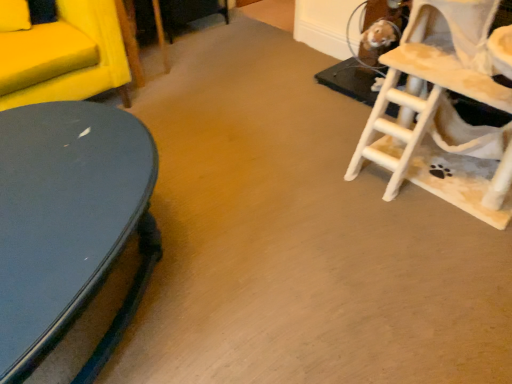
The height and width of the screenshot is (384, 512). I want to click on free location in front of white wooden ladder at right, so click(x=417, y=302).